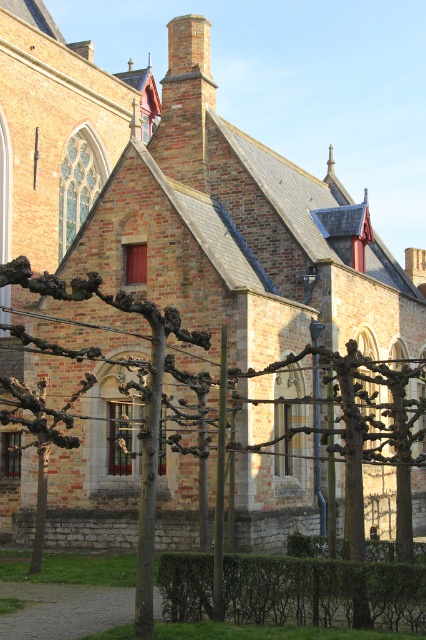
Question: Can you confirm if green leafy hedge at lower center is positioned to the right of bare branches at center?

Choices:
 (A) yes
 (B) no

Answer: (A)

Question: Observing the image, what is the correct spatial positioning of green leafy hedge at lower center in reference to bare branches at center?

Choices:
 (A) left
 (B) right

Answer: (B)

Question: Which point appears closest to the camera in this image?

Choices:
 (A) (314, 440)
 (B) (405, 624)

Answer: (B)

Question: Does green leafy hedge at lower center lie behind bare branches at center?

Choices:
 (A) no
 (B) yes

Answer: (B)

Question: Which point appears farthest from the camera in this image?

Choices:
 (A) (278, 609)
 (B) (143, 577)

Answer: (A)